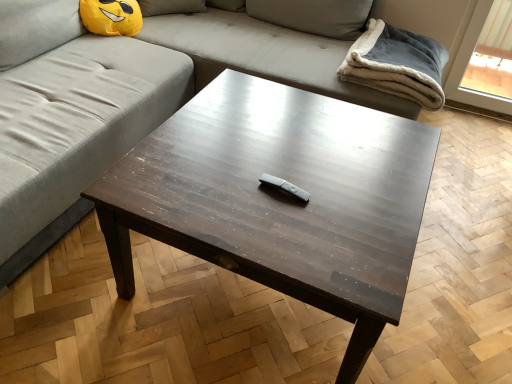
Question: Can you confirm if gray fabric couch at upper center is smaller than gray matte wii remote at center?

Choices:
 (A) no
 (B) yes

Answer: (A)

Question: Is gray fabric couch at upper center to the left of gray matte wii remote at center from the viewer's perspective?

Choices:
 (A) no
 (B) yes

Answer: (B)

Question: From a real-world perspective, is gray fabric couch at upper center physically below gray matte wii remote at center?

Choices:
 (A) yes
 (B) no

Answer: (A)

Question: Is gray fabric couch at upper center turned away from gray matte wii remote at center?

Choices:
 (A) yes
 (B) no

Answer: (B)

Question: Can gray matte wii remote at center be found inside gray fabric couch at upper center?

Choices:
 (A) no
 (B) yes

Answer: (B)

Question: From a real-world perspective, relative to dark wood remote control at center, is gray fleece blanket at upper right vertically above or below?

Choices:
 (A) above
 (B) below

Answer: (A)

Question: In the image, is gray fleece blanket at upper right positioned in front of or behind dark wood remote control at center?

Choices:
 (A) front
 (B) behind

Answer: (B)

Question: Would you say gray fleece blanket at upper right is inside or outside dark wood remote control at center?

Choices:
 (A) outside
 (B) inside

Answer: (A)

Question: From the image's perspective, is gray fleece blanket at upper right above or below dark wood remote control at center?

Choices:
 (A) below
 (B) above

Answer: (B)

Question: Relative to dark wood remote control at center, is gray matte wii remote at center in front or behind?

Choices:
 (A) behind
 (B) front

Answer: (A)

Question: From the image's perspective, is gray matte wii remote at center located above or below dark wood remote control at center?

Choices:
 (A) above
 (B) below

Answer: (A)

Question: Looking at their shapes, would you say gray matte wii remote at center is wider or thinner than dark wood remote control at center?

Choices:
 (A) thin
 (B) wide

Answer: (A)

Question: Is point (267, 175) closer or farther from the camera than point (367, 326)?

Choices:
 (A) farther
 (B) closer

Answer: (A)

Question: Which is correct: gray matte wii remote at center is inside gray fabric couch at upper center, or outside of it?

Choices:
 (A) inside
 (B) outside

Answer: (A)

Question: From the image's perspective, is gray matte wii remote at center located above or below gray fabric couch at upper center?

Choices:
 (A) below
 (B) above

Answer: (A)